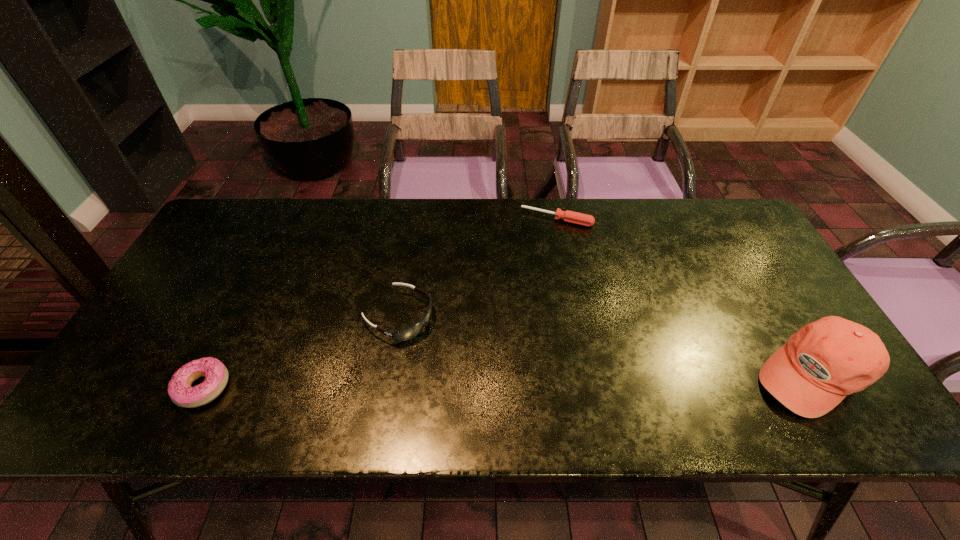
I want to click on object located at the near right corner, so (826, 360).

Find the location of `free space at the far edge of the desktop`. free space at the far edge of the desktop is located at coordinates (524, 221).

Find the location of a particular element. vacant space at the near edge of the desktop is located at coordinates (627, 364).

In the image, there is a desktop. Where is `vacant area at the left edge`? This screenshot has width=960, height=540. vacant area at the left edge is located at coordinates (203, 259).

At what (x,y) coordinates should I click in order to perform the action: click on vacant position at the right edge of the desktop. Please return your answer as a coordinate pair (x, y). This screenshot has width=960, height=540. Looking at the image, I should click on (767, 347).

Identify the location of free space at the far right corner of the desktop. The width and height of the screenshot is (960, 540). (716, 199).

The image size is (960, 540). Find the location of `vacant space that is in between the second object from left to right and the second shortest object`. vacant space that is in between the second object from left to right and the second shortest object is located at coordinates (300, 352).

Where is `vacant region between the farthest object and the tallest object`? The image size is (960, 540). vacant region between the farthest object and the tallest object is located at coordinates (684, 296).

You are a GUI agent. You are given a task and a screenshot of the screen. Output one action in this format:
    pyautogui.click(x=<x>, y=<y>)
    Task: Click on the free space between the third tallest object and the farthest object
    This screenshot has height=540, width=960.
    Given the screenshot: What is the action you would take?
    pyautogui.click(x=380, y=303)

You are a GUI agent. You are given a task and a screenshot of the screen. Output one action in this format:
    pyautogui.click(x=<x>, y=<y>)
    Task: Click on the free spot between the screwdriver and the goggles
    Image resolution: width=960 pixels, height=540 pixels.
    Given the screenshot: What is the action you would take?
    pyautogui.click(x=477, y=268)